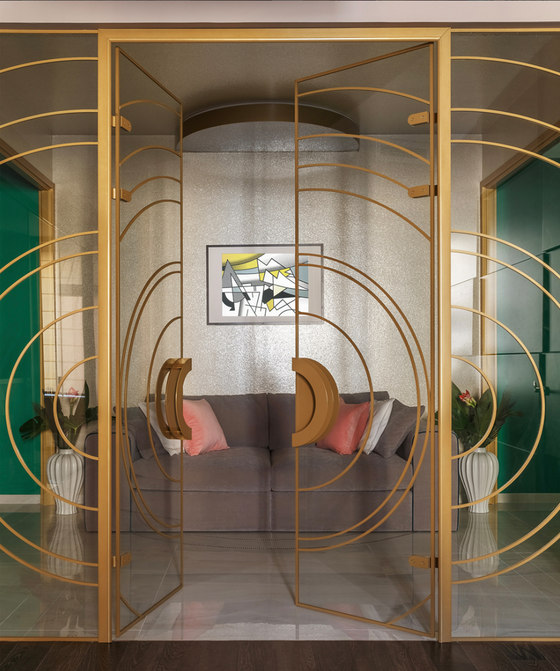
Where is `door frame`? The height and width of the screenshot is (671, 560). door frame is located at coordinates (442, 317), (106, 364).